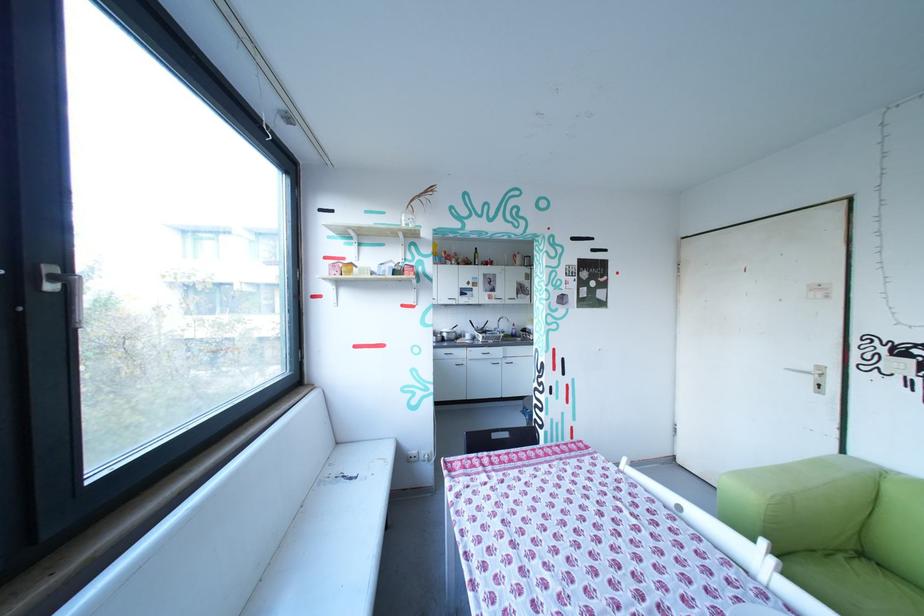
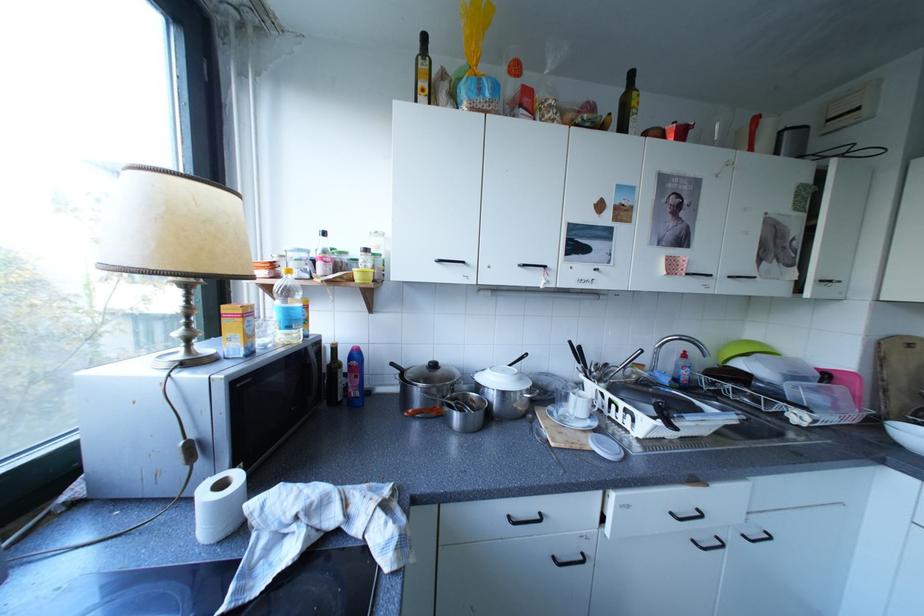
Question: The images are taken continuously from a first-person perspective. In which direction are you moving?

Choices:
 (A) Left
 (B) Right
 (C) Forward
 (D) Backward

Answer: (C)